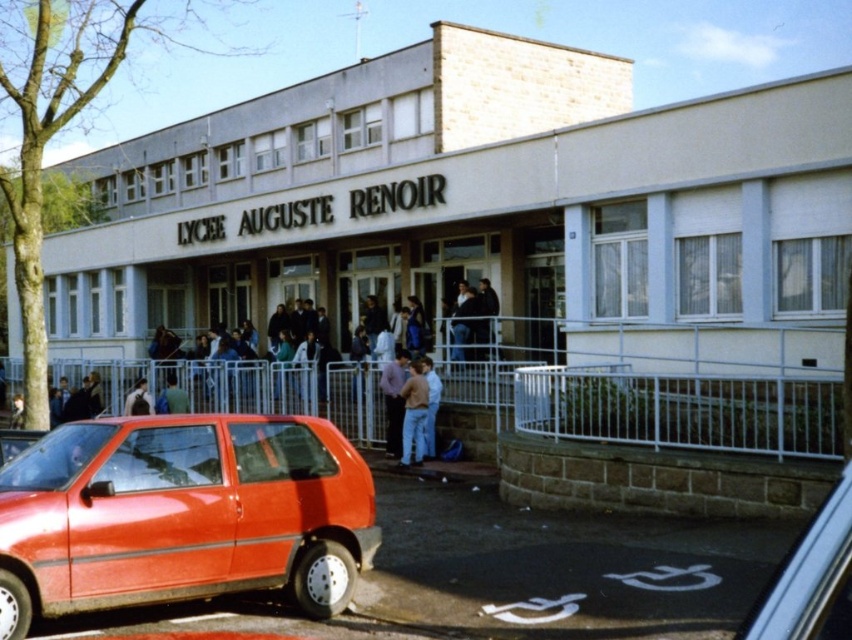
You are a delivery person trying to park your delivery van, which is 2 meters wide, in the same spot as the shiny red hatchback at lower left. Based on the scene, can your van fit in that parking space if the light blue jeans at center are 1.5 meters wide?

The shiny red hatchback at lower left is wider than the light blue jeans at center, which are 1.5 meters wide. Since the van is 2 meters wide, it can fit in the parking space as the hatchback already occupies a space wider than 1.5 meters.

You are standing at the entrance of the school and want to take a photo of the building without the metallic red car at lower right. In which direction should you move to ensure the car is no longer in the frame?

Move to the left to ensure the metallic red car at lower right is no longer in the frame.

You are a photographer trying to capture the entire building facade without any obstructions. You notice two cars parked in the foreground. Which car, the shiny red hatchback at lower left or the metallic red car at lower right, is taller and might block more of the building in your photo?

The shiny red hatchback at lower left is taller than the metallic red car at lower right, so it might block more of the building in your photo.